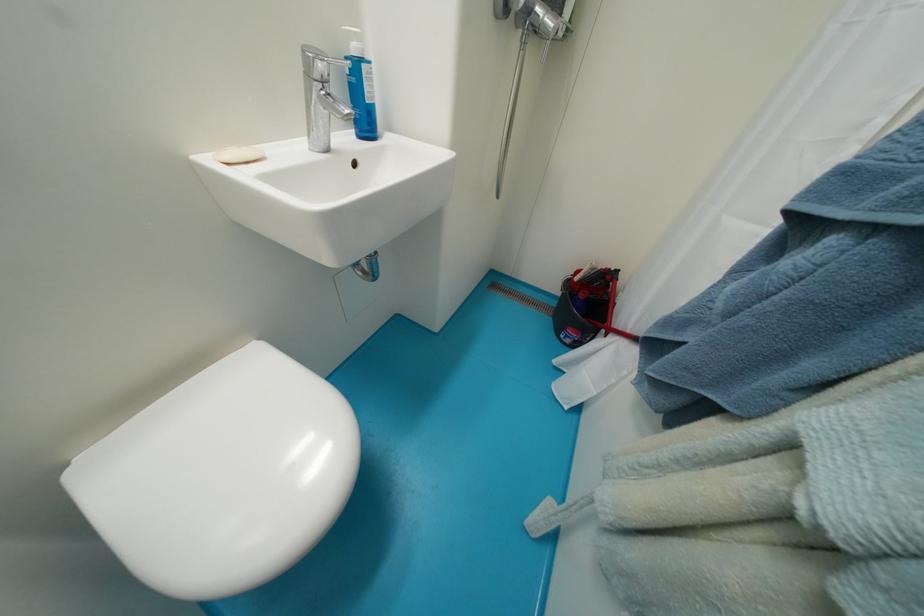
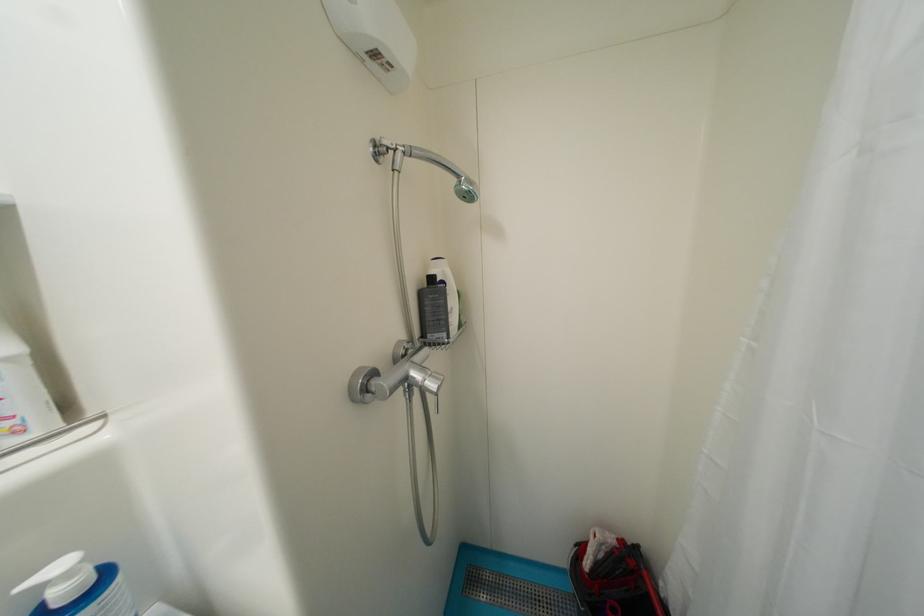
Find the pixel in the second image that matches (363,41) in the first image.

(75, 576)